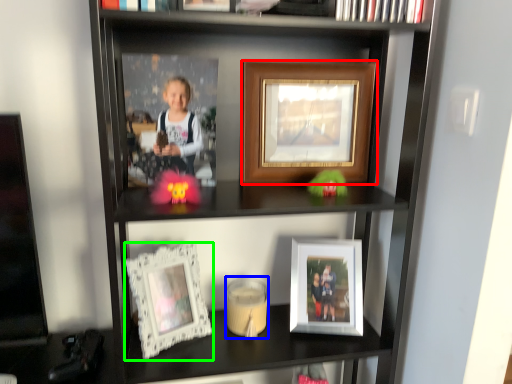
Question: Considering the real-world distances, which object is farthest from picture frame (highlighted by a red box)? candle holder (highlighted by a blue box) or picture frame (highlighted by a green box)?

Choices:
 (A) candle holder
 (B) picture frame

Answer: (A)